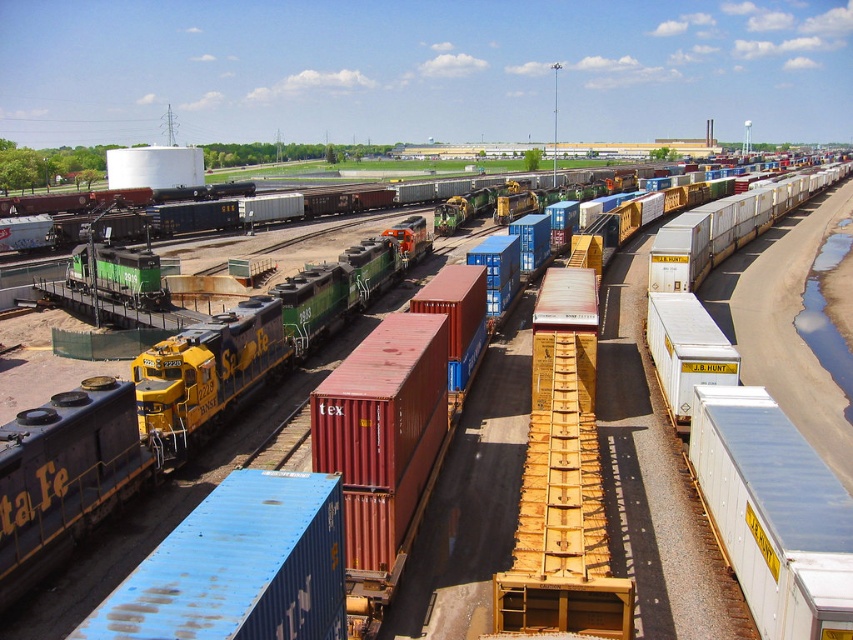
Question: Is yellow matte train car at lower left wider than blue matte container at center?

Choices:
 (A) yes
 (B) no

Answer: (A)

Question: Can you confirm if yellow matte train car at lower left is thinner than blue matte container at center?

Choices:
 (A) yes
 (B) no

Answer: (B)

Question: Does yellow matte train car at lower left have a smaller size compared to blue matte container at center?

Choices:
 (A) yes
 (B) no

Answer: (B)

Question: Which of the following is the closest to the observer?

Choices:
 (A) yellow matte train car at lower left
 (B) blue matte container at center

Answer: (B)